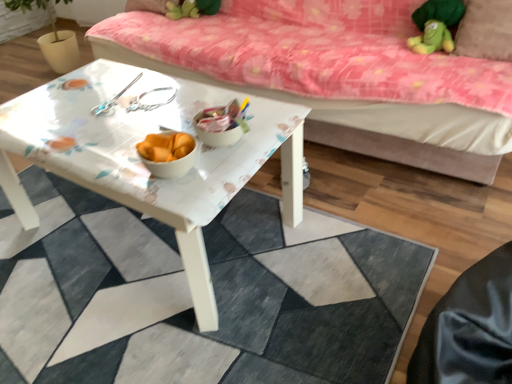
Locate an element on the screen. This screenshot has height=384, width=512. white glossy table at center is located at coordinates (142, 159).

What is the approximate height of brown fabric pillow at upper right?

It is 8.93 inches.

You are a GUI agent. You are given a task and a screenshot of the screen. Output one action in this format:
    pyautogui.click(x=<x>, y=<y>)
    Task: Click on the pink floral fabric studio couch at upper center
    Image resolution: width=512 pixels, height=384 pixels.
    Given the screenshot: What is the action you would take?
    pyautogui.click(x=357, y=116)

You are a GUI agent. You are given a task and a screenshot of the screen. Output one action in this format:
    pyautogui.click(x=<x>, y=<y>)
    Task: Click on the white glossy table at center
    
    Given the screenshot: What is the action you would take?
    tap(142, 159)

Considering the relative positions of white glossy table at center and brown fabric pillow at upper right in the image provided, is white glossy table at center to the right of brown fabric pillow at upper right from the viewer's perspective?

No.

From a real-world perspective, which object stands above the other?

brown fabric pillow at upper right is physically above.

Is the position of white glossy table at center more distant than that of brown fabric pillow at upper right?

No, it is in front of brown fabric pillow at upper right.

Is white glossy table at center situated inside brown fabric pillow at upper right or outside?

white glossy table at center is not inside brown fabric pillow at upper right, it's outside.

Considering the sizes of pink floral fabric studio couch at upper center and green plush toy at upper center in the image, is pink floral fabric studio couch at upper center taller or shorter than green plush toy at upper center?

pink floral fabric studio couch at upper center is taller than green plush toy at upper center.

Considering the sizes of objects pink floral fabric studio couch at upper center and green plush toy at upper center in the image provided, who is thinner, pink floral fabric studio couch at upper center or green plush toy at upper center?

With smaller width is green plush toy at upper center.

The width and height of the screenshot is (512, 384). Identify the location of toy above the pink floral fabric studio couch at upper center (from the image's perspective). (192, 9).

Is brown fabric pillow at upper right taller or shorter than green plush toy at upper center?

brown fabric pillow at upper right is taller than green plush toy at upper center.

Is brown fabric pillow at upper right far away from green plush toy at upper center?

That's right, there is a large distance between brown fabric pillow at upper right and green plush toy at upper center.

Is brown fabric pillow at upper right facing towards green plush toy at upper center?

No, brown fabric pillow at upper right is not aimed at green plush toy at upper center.

Is white glossy table at center shorter than pink floral fabric studio couch at upper center?

Yes, white glossy table at center is shorter than pink floral fabric studio couch at upper center.

From a real-world perspective, relative to pink floral fabric studio couch at upper center, is white glossy table at center vertically above or below?

In terms of real-world spatial position, white glossy table at center is below pink floral fabric studio couch at upper center.

Is white glossy table at center with pink floral fabric studio couch at upper center?

No, white glossy table at center is not touching pink floral fabric studio couch at upper center.

Is white glossy table at center facing away from green plush toy at upper center?

white glossy table at center does not have its back to green plush toy at upper center.

Does white glossy table at center have a greater height compared to green plush toy at upper center?

Yes.

Looking at the image, does white glossy table at center seem bigger or smaller compared to green plush toy at upper center?

Considering their sizes, white glossy table at center takes up more space than green plush toy at upper center.

Does point (1, 371) appear closer or farther from the camera than point (71, 172)?

Point (1, 371).

From the picture: Does white glossy table at center lie behind white glossy table at center?

No, it is not.

From the image's perspective, is white glossy table at center located above or below white glossy table at center?

white glossy table at center is below white glossy table at center.

Does white glossy table at center have a greater width compared to white glossy table at center?

Yes.

Considering the sizes of objects green plush toy at upper center and pink floral fabric studio couch at upper center in the image provided, who is bigger, green plush toy at upper center or pink floral fabric studio couch at upper center?

pink floral fabric studio couch at upper center.

I want to click on toy that is behind the pink floral fabric studio couch at upper center, so click(x=192, y=9).

Is green plush toy at upper center situated inside pink floral fabric studio couch at upper center or outside?

green plush toy at upper center fits inside pink floral fabric studio couch at upper center.

Considering the relative sizes of green plush toy at upper center and pink floral fabric studio couch at upper center in the image provided, is green plush toy at upper center wider than pink floral fabric studio couch at upper center?

In fact, green plush toy at upper center might be narrower than pink floral fabric studio couch at upper center.

The image size is (512, 384). I want to click on pillow that appears on the right of white glossy table at center, so click(485, 30).

This screenshot has width=512, height=384. Find the location of `studio couch that appears below the green plush toy at upper center (from the image's perspective)`. studio couch that appears below the green plush toy at upper center (from the image's perspective) is located at coordinates (357, 116).

Considering their positions, is white glossy table at center positioned closer to pink floral fabric studio couch at upper center than green plush toy at upper center?

Among the two, white glossy table at center is located nearer to pink floral fabric studio couch at upper center.

When comparing their distances from pink floral fabric studio couch at upper center, does white glossy table at center or brown fabric pillow at upper right seem closer?

brown fabric pillow at upper right is closer to pink floral fabric studio couch at upper center.

From the image, which object appears to be nearer to white glossy table at center, pink floral fabric studio couch at upper center or brown fabric pillow at upper right?

Based on the image, pink floral fabric studio couch at upper center appears to be nearer to white glossy table at center.

Based on their spatial positions, is brown fabric pillow at upper right or green plush toy at upper center closer to white glossy table at center?

green plush toy at upper center lies closer to white glossy table at center than the other object.

Looking at the image, which one is located closer to green plush toy at upper center, pink floral fabric studio couch at upper center or brown fabric pillow at upper right?

Based on the image, pink floral fabric studio couch at upper center appears to be nearer to green plush toy at upper center.

In the scene shown: From the image, which object appears to be nearer to green plush toy at upper center, brown fabric pillow at upper right or white glossy table at center?

white glossy table at center is positioned closer to the anchor green plush toy at upper center.

Considering their positions, is green plush toy at upper center positioned closer to white glossy table at center than pink floral fabric studio couch at upper center?

Among the two, pink floral fabric studio couch at upper center is located nearer to white glossy table at center.

Estimate the real-world distances between objects in this image. Which object is closer to white glossy table at center, pink floral fabric studio couch at upper center or white glossy table at center?

white glossy table at center.

You are a GUI agent. You are given a task and a screenshot of the screen. Output one action in this format:
    pyautogui.click(x=<x>, y=<y>)
    Task: Click on the toy between white glossy table at center and brown fabric pillow at upper right from left to right
    Image resolution: width=512 pixels, height=384 pixels.
    Given the screenshot: What is the action you would take?
    pyautogui.click(x=192, y=9)

Identify the location of table between white glossy table at center and green plush toy at upper center in the front-back direction. tap(142, 159).

Where is `studio couch between green plush toy at upper center and brown fabric pillow at upper right`? The width and height of the screenshot is (512, 384). studio couch between green plush toy at upper center and brown fabric pillow at upper right is located at coordinates (357, 116).

Where is `studio couch between white glossy table at center and green plush toy at upper center along the z-axis`? The image size is (512, 384). studio couch between white glossy table at center and green plush toy at upper center along the z-axis is located at coordinates (357, 116).